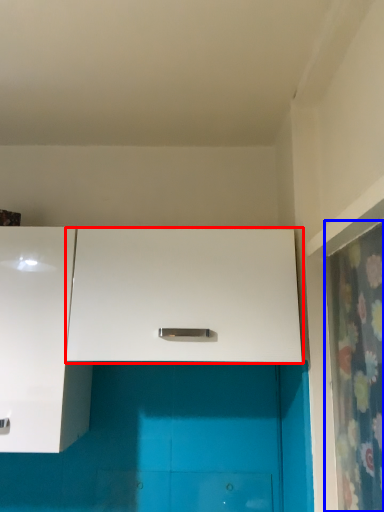
Question: Among these objects, which one is nearest to the camera, cabinetry (highlighted by a red box) or shower curtain (highlighted by a blue box)?

Choices:
 (A) cabinetry
 (B) shower curtain

Answer: (B)